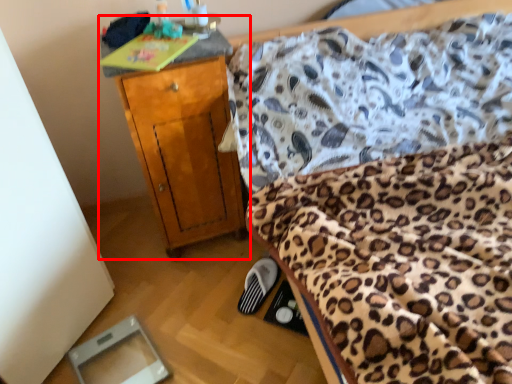
Question: Where is nightstand (annotated by the red box) located in relation to footwear in the image?

Choices:
 (A) left
 (B) right

Answer: (A)